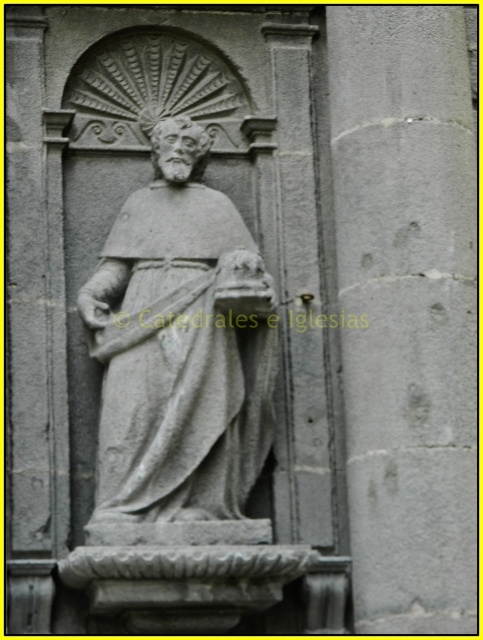
You are an architect examining the stone relief sculpture. You need to determine the exact location of the gray stone pillar at center in the image. What are its coordinates?

The gray stone pillar at center is located at coordinates point (407, 308).

You are an architect examining the stone relief sculpture. You notice the gray stone pillar at center and the gray stone statue at center. Which object has a smaller diameter?

The gray stone pillar at center is thinner than the gray stone statue at center, so the gray stone pillar at center has a smaller diameter.

You are an architect designing a new building and want to replicate the gray stone pillar at center from the image. If your design requires the pillar to be placed exactly 70 meters away from the entrance, will the original pillar in the image meet your requirement?

The gray stone pillar at center is 69.97 meters from the viewer, which is very close to 70 meters. Therefore, it meets the requirement as the difference is negligible.